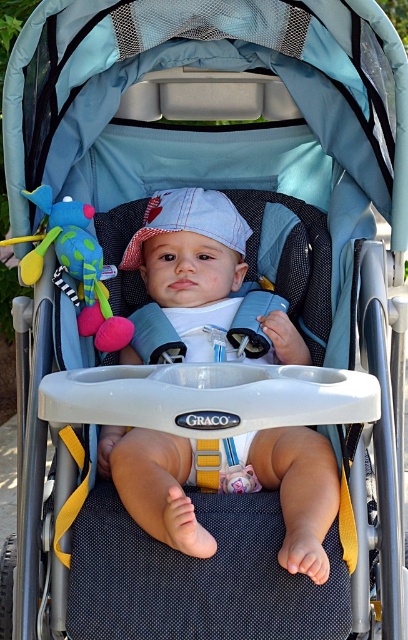
Based on the photo, you are a photographer trying to capture a closeup of the baby in the stroller. You want to focus on the white cotton hat at center and the green plush toy at center. Which object should you adjust your camera focus on first if you want to ensure both are in focus?

The white cotton hat at center is closer to the viewer than the green plush toy at center, so you should focus on the white cotton hat at center first to ensure both are in focus.

What are the coordinates of the white cotton hat at center in the image?

The white cotton hat at center is located at coordinates (192, 260).